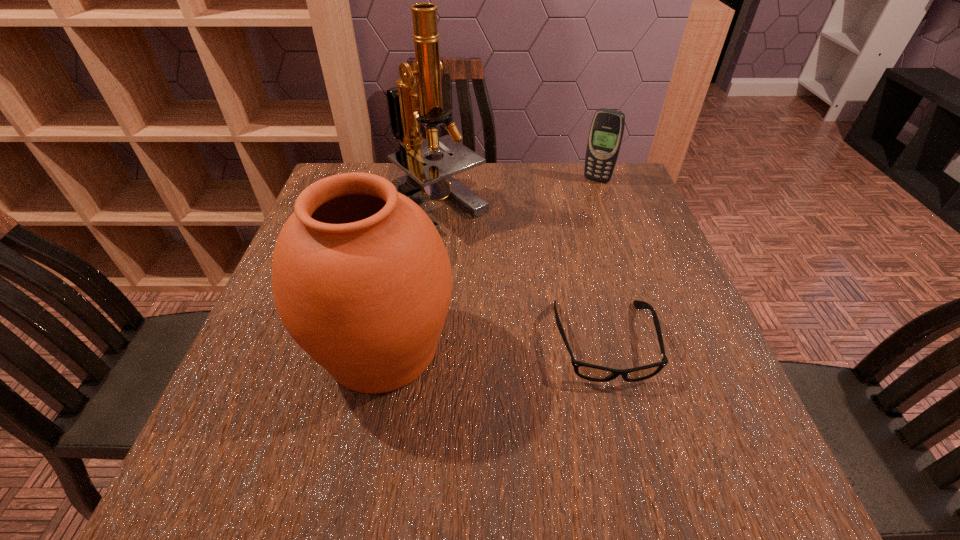
Image resolution: width=960 pixels, height=540 pixels. Find the location of `free spot at the far edge of the desktop`. free spot at the far edge of the desktop is located at coordinates (463, 174).

Identify the location of vacant space at the right edge of the desktop. (655, 264).

You are a GUI agent. You are given a task and a screenshot of the screen. Output one action in this format:
    pyautogui.click(x=<x>, y=<y>)
    Task: Click on the vacant space at the far left corner of the desktop
    
    Given the screenshot: What is the action you would take?
    pyautogui.click(x=348, y=166)

This screenshot has height=540, width=960. Identify the location of vacant space at the far right corner of the desktop. (615, 174).

At what (x,y) coordinates should I click in order to perform the action: click on free spot between the microscope and the spectacles. Please return your answer as a coordinate pair (x, y). Image resolution: width=960 pixels, height=540 pixels. Looking at the image, I should click on (520, 274).

Where is `free space between the urn and the third tallest object`? free space between the urn and the third tallest object is located at coordinates (490, 264).

Find the location of a particular element. vacant point located between the tallest object and the third tallest object is located at coordinates (517, 193).

Image resolution: width=960 pixels, height=540 pixels. Find the location of `blank region between the spectacles and the third tallest object`. blank region between the spectacles and the third tallest object is located at coordinates (600, 261).

This screenshot has width=960, height=540. Find the location of `unoccupied position between the second shortest object and the urn`. unoccupied position between the second shortest object and the urn is located at coordinates (490, 264).

Where is `free spot between the spectacles and the second tallest object`? free spot between the spectacles and the second tallest object is located at coordinates (493, 345).